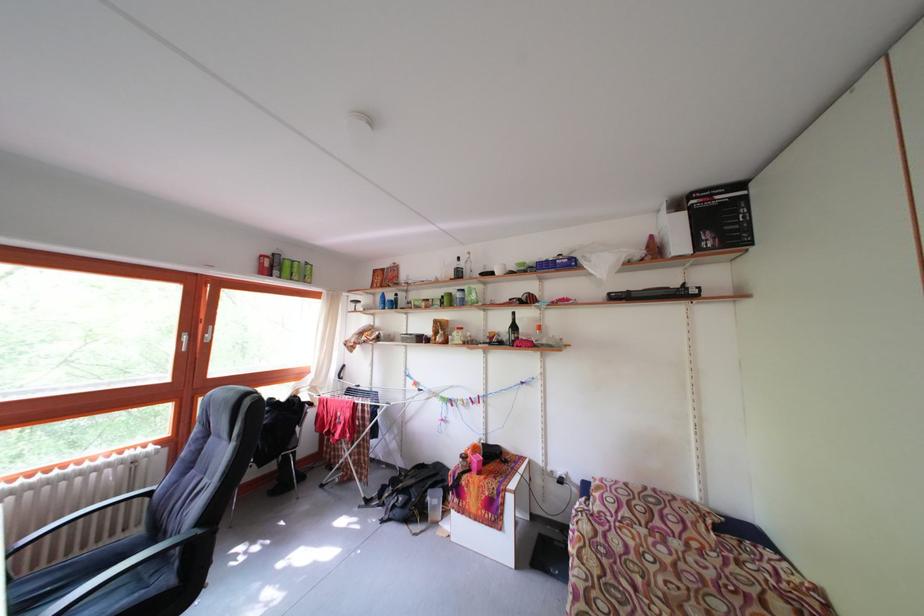
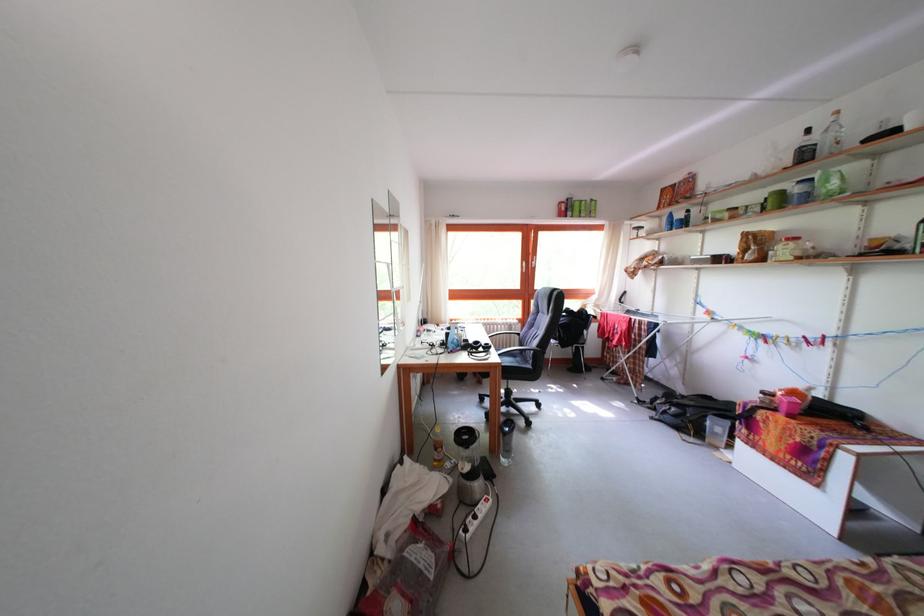
Question: Based on the continuous images, in which direction is the camera rotating? Reply with the corresponding letter.

Choices:
 (A) Left
 (B) Right
 (C) Up
 (D) Down

Answer: (A)